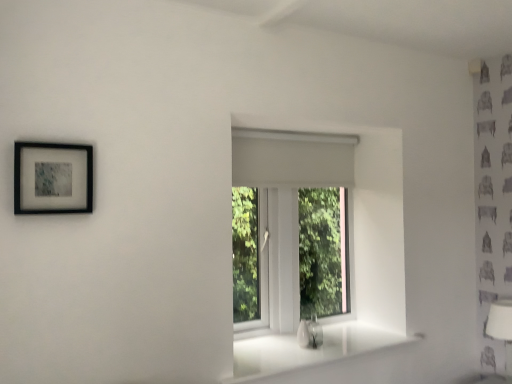
The image size is (512, 384). I want to click on vacant area that is in front of white glossy sink at lower center, so click(x=303, y=354).